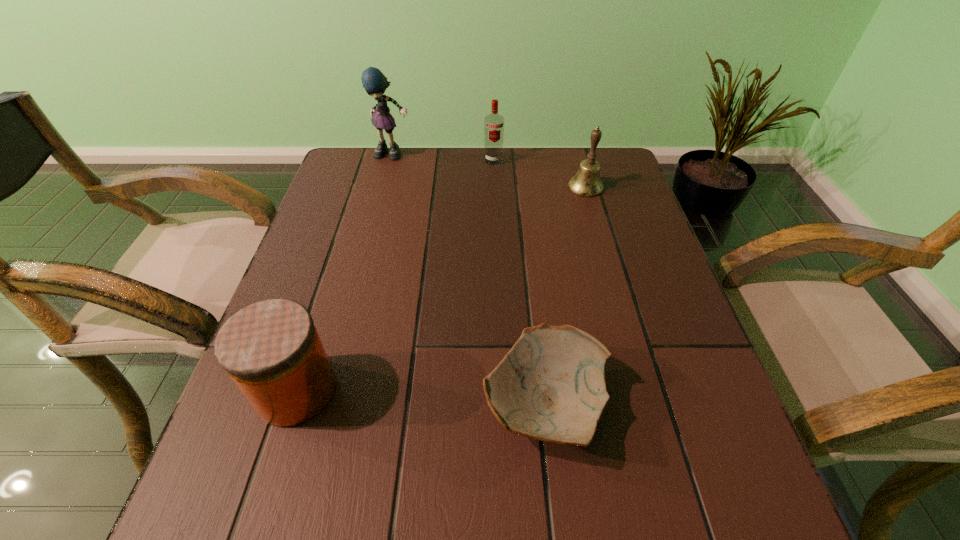
In the image, there is a desktop. Where is `vacant space at the near edge`? vacant space at the near edge is located at coordinates (324, 538).

You are a GUI agent. You are given a task and a screenshot of the screen. Output one action in this format:
    pyautogui.click(x=<x>, y=<y>)
    Task: Click on the free space at the left edge of the desktop
    
    Given the screenshot: What is the action you would take?
    pyautogui.click(x=329, y=244)

The image size is (960, 540). In the image, there is a desktop. Identify the location of free region at the right edge. (625, 199).

Image resolution: width=960 pixels, height=540 pixels. In the image, there is a desktop. What are the coordinates of `vacant region at the near left corner` in the screenshot? It's located at (261, 513).

Image resolution: width=960 pixels, height=540 pixels. In order to click on vacant space at the far right corner of the desktop in this screenshot , I will do `click(618, 168)`.

Find the location of a particular element. free spot between the tallest object and the vodka is located at coordinates (444, 158).

This screenshot has width=960, height=540. I want to click on vacant space that's between the rightmost object and the vodka, so click(x=540, y=173).

You are a GUI agent. You are given a task and a screenshot of the screen. Output one action in this format:
    pyautogui.click(x=<x>, y=<y>)
    Task: Click on the empty space that is in between the jar and the vodka
    The width and height of the screenshot is (960, 540).
    Given the screenshot: What is the action you would take?
    pyautogui.click(x=395, y=275)

You are a GUI agent. You are given a task and a screenshot of the screen. Output one action in this format:
    pyautogui.click(x=<x>, y=<y>)
    Task: Click on the vacant area between the jar and the vodka
    
    Given the screenshot: What is the action you would take?
    pyautogui.click(x=395, y=275)

The image size is (960, 540). I want to click on free space between the jar and the pottery, so click(x=420, y=397).